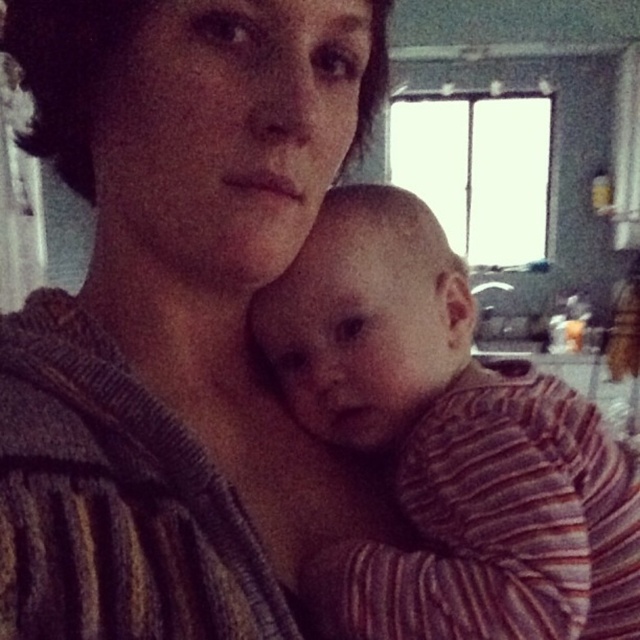
Question: Does striped sweater at center have a lesser width compared to striped fabric baby at center?

Choices:
 (A) yes
 (B) no

Answer: (B)

Question: Which point is farther to the camera?

Choices:
 (A) striped fabric baby at center
 (B) striped sweater at center

Answer: (A)

Question: Is striped sweater at center further to the viewer compared to striped fabric baby at center?

Choices:
 (A) no
 (B) yes

Answer: (A)

Question: Which point is farther from the camera taking this photo?

Choices:
 (A) (492, 428)
 (B) (35, 435)

Answer: (A)

Question: Is striped sweater at center smaller than striped fabric baby at center?

Choices:
 (A) no
 (B) yes

Answer: (A)